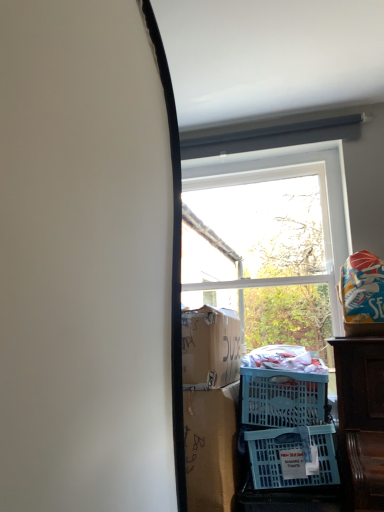
Question: Is blue plastic basket at lower right with transparent glass window at center?

Choices:
 (A) no
 (B) yes

Answer: (A)

Question: Considering the relative sizes of blue plastic basket at lower right and transparent glass window at center in the image provided, is blue plastic basket at lower right thinner than transparent glass window at center?

Choices:
 (A) no
 (B) yes

Answer: (A)

Question: Can we say blue plastic basket at lower right lies outside transparent glass window at center?

Choices:
 (A) yes
 (B) no

Answer: (A)

Question: Is blue plastic basket at lower right looking in the opposite direction of transparent glass window at center?

Choices:
 (A) no
 (B) yes

Answer: (A)

Question: Can transparent glass window at center be found inside blue plastic basket at lower right?

Choices:
 (A) yes
 (B) no

Answer: (B)

Question: Is blue plastic basket at lower right further to camera compared to transparent glass window at center?

Choices:
 (A) yes
 (B) no

Answer: (B)

Question: Considering the relative sizes of transparent glass window at center and blue plastic basket at lower right in the image provided, is transparent glass window at center smaller than blue plastic basket at lower right?

Choices:
 (A) no
 (B) yes

Answer: (A)

Question: Can you confirm if transparent glass window at center is positioned to the left of blue plastic basket at lower right?

Choices:
 (A) no
 (B) yes

Answer: (A)

Question: From a real-world perspective, is transparent glass window at center physically below blue plastic basket at lower right?

Choices:
 (A) yes
 (B) no

Answer: (B)

Question: Is transparent glass window at center not close to blue plastic basket at lower right?

Choices:
 (A) no
 (B) yes

Answer: (B)

Question: Is transparent glass window at center thinner than blue plastic basket at lower right?

Choices:
 (A) yes
 (B) no

Answer: (A)

Question: Does transparent glass window at center turn towards blue plastic basket at lower right?

Choices:
 (A) yes
 (B) no

Answer: (B)

Question: Would you say blue plastic basket at lower right is to the left or to the right of transparent glass window at center in the picture?

Choices:
 (A) right
 (B) left

Answer: (B)